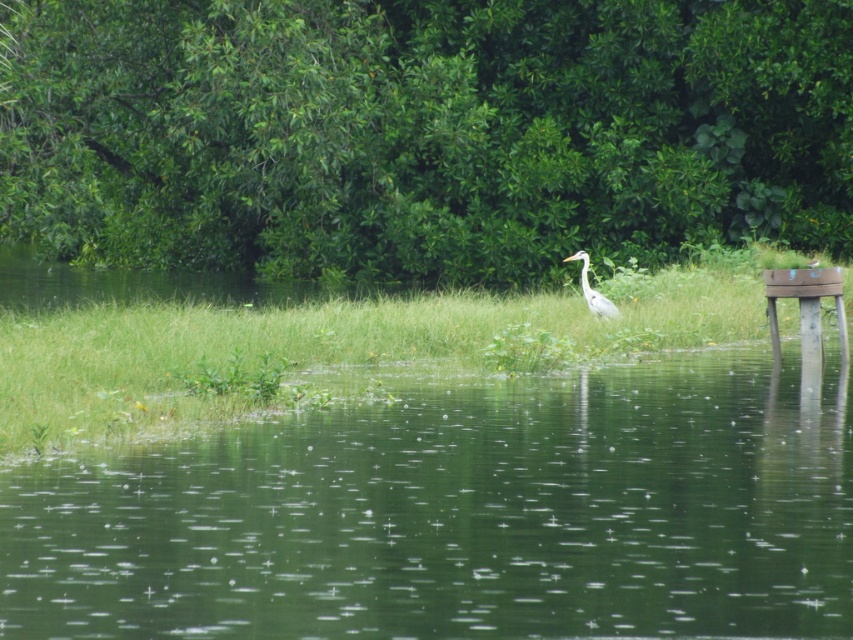
Question: Can you confirm if green leafy tree at center is positioned below green grass at center?

Choices:
 (A) no
 (B) yes

Answer: (A)

Question: Based on their relative distances, which object is farther from the green water at center?

Choices:
 (A) green leafy tree at center
 (B) green grass at center
 (C) white smooth heron at center

Answer: (A)

Question: Can you confirm if green leafy tree at center is wider than white smooth heron at center?

Choices:
 (A) yes
 (B) no

Answer: (A)

Question: Estimate the real-world distances between objects in this image. Which object is closer to the green grass at center?

Choices:
 (A) white smooth heron at center
 (B) green water at center
 (C) green leafy tree at center

Answer: (C)

Question: Which point is closer to the camera?

Choices:
 (A) (595, 301)
 (B) (729, 486)
 (C) (846, 330)

Answer: (B)

Question: Considering the relative positions of green leafy tree at center and green water at center in the image provided, where is green leafy tree at center located with respect to green water at center?

Choices:
 (A) above
 (B) below

Answer: (A)